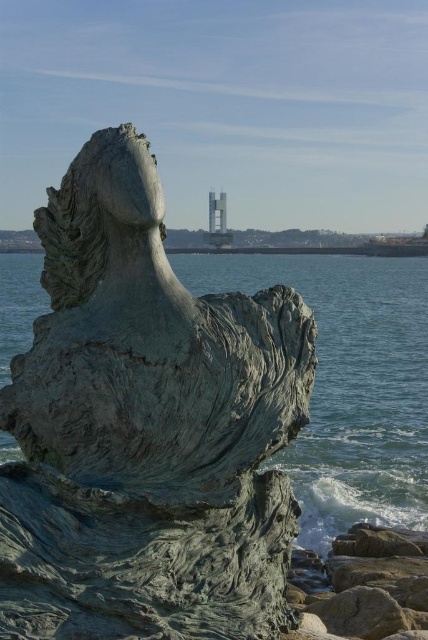
Which of these two, bronze sculpture at center or rough stone rock at lower right, stands taller?

With more height is rough stone rock at lower right.

Which is in front, point (157, 513) or point (329, 563)?

Point (157, 513) is more forward.

Which is in front, point (130, 483) or point (418, 552)?

Point (130, 483)

Find the location of a particular element. Image resolution: width=428 pixels, height=640 pixels. bronze sculpture at center is located at coordinates (145, 428).